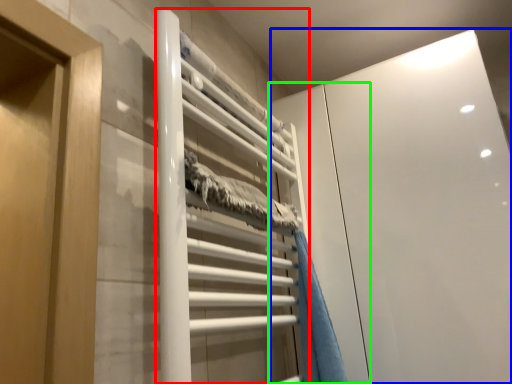
Question: Which object is the farthest from stair (highlighted by a red box)? Choose among these: glass door (highlighted by a blue box) or screen door (highlighted by a green box).

Choices:
 (A) glass door
 (B) screen door

Answer: (A)